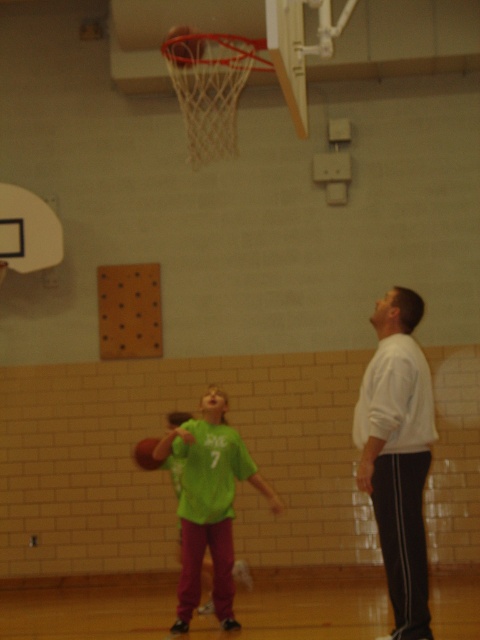
Which of these two, white smooth shirt at right or rubber textured basketball at center, stands taller?

Standing taller between the two is white smooth shirt at right.

Which is behind, point (418, 582) or point (168, 45)?

The point (168, 45) is behind.

Identify the location of white smooth shirt at right. (397, 454).

Does rubber textured basketball at center appear under rubber basketball at lower center?

No, rubber textured basketball at center is not below rubber basketball at lower center.

Is point (192, 29) farther from camera compared to point (142, 449)?

That is False.

Between point (191, 38) and point (149, 461), which one is positioned behind?

Positioned behind is point (149, 461).

Identify the location of rubber textured basketball at center. This screenshot has height=640, width=480. (183, 45).

Can you confirm if white smooth shirt at right is smaller than green matte shirt at center?

Correct, white smooth shirt at right occupies less space than green matte shirt at center.

In the scene shown: Can you confirm if white smooth shirt at right is shorter than green matte shirt at center?

Incorrect, white smooth shirt at right's height does not fall short of green matte shirt at center's.

Where is `white smooth shirt at right`? white smooth shirt at right is located at coordinates (397, 454).

The image size is (480, 640). What are the coordinates of `white smooth shirt at right` in the screenshot? It's located at (397, 454).